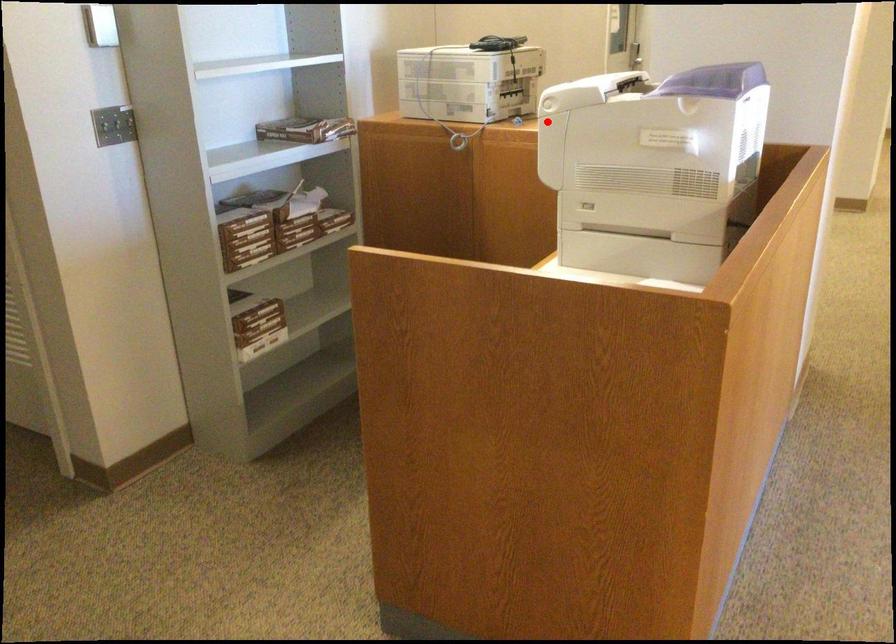
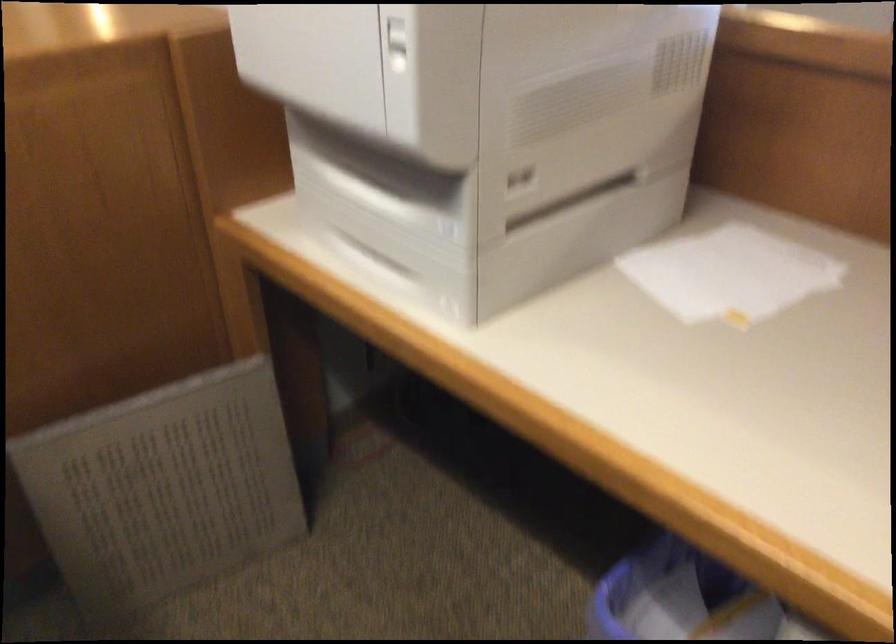
Question: I am providing you with two images of the same scene from different viewpoints. Given a red point in image1, look at the same physical point in image2. Is it:

Choices:
 (A) Closer to the viewpoint
 (B) Farther from the viewpoint

Answer: (A)